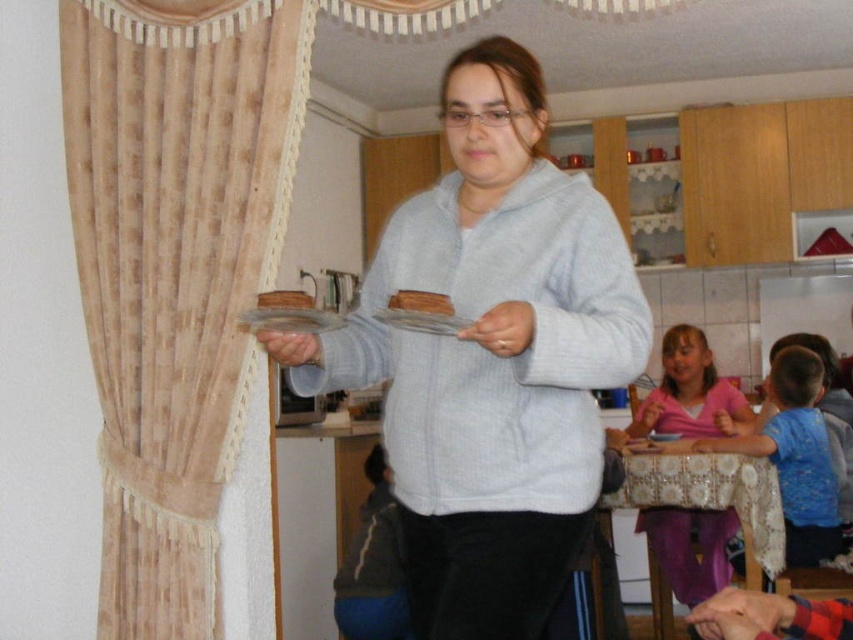
Question: Which point is closer to the camera taking this photo?

Choices:
 (A) (523, 621)
 (B) (183, 243)
 (C) (267, 292)

Answer: (C)

Question: Among these points, which one is farthest from the camera?

Choices:
 (A) (404, 294)
 (B) (294, 374)
 (C) (212, 628)
 (D) (289, 294)

Answer: (C)

Question: From the image, what is the correct spatial relationship of pink fabric shirt at lower right in relation to brown wooden cake at center?

Choices:
 (A) left
 (B) right

Answer: (B)

Question: Can you confirm if beige textured curtain at left is positioned to the left of pink fabric shirt at lower right?

Choices:
 (A) yes
 (B) no

Answer: (A)

Question: Which object is positioned farthest from the brown crumbly cake at center?

Choices:
 (A) pink fabric shirt at lower right
 (B) beige textured curtain at left
 (C) brown wooden cake at center
 (D) gray fleece sweater at center

Answer: (A)

Question: Considering the relative positions of beige textured curtain at left and brown crumbly cake at center in the image provided, where is beige textured curtain at left located with respect to brown crumbly cake at center?

Choices:
 (A) below
 (B) above

Answer: (A)